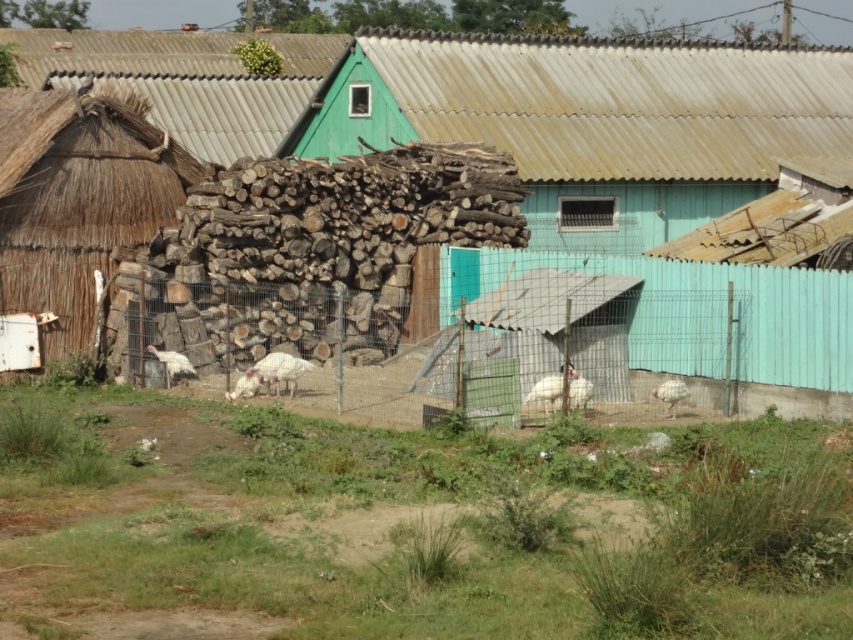
Is wire mesh fence at center wider than thatched straw hut at left?

No, wire mesh fence at center is not wider than thatched straw hut at left.

Between wire mesh fence at center and thatched straw hut at left, which one appears on the right side from the viewer's perspective?

wire mesh fence at center

The image size is (853, 640). I want to click on wire mesh fence at center, so click(680, 337).

Consider the image. Who is higher up, wire mesh fence at center or white feathered turkey at lower right?

Positioned higher is wire mesh fence at center.

Is wire mesh fence at center positioned before white feathered turkey at lower right?

No, it is not.

Describe the element at coordinates (680, 337) in the screenshot. I see `wire mesh fence at center` at that location.

Where is `wire mesh fence at center`? The height and width of the screenshot is (640, 853). wire mesh fence at center is located at coordinates (680, 337).

Who is positioned more to the right, white feathered turkey at lower right or white feathered turkey at center?

From the viewer's perspective, white feathered turkey at lower right appears more on the right side.

Between white feathered turkey at lower right and white feathered turkey at center, which one is positioned lower?

Positioned lower is white feathered turkey at center.

I want to click on white feathered turkey at lower right, so click(x=670, y=394).